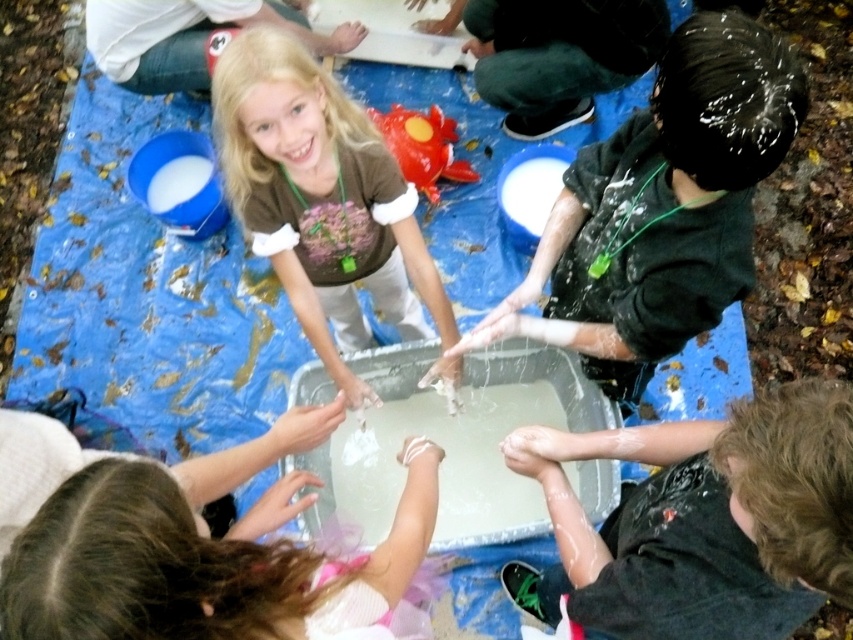
Question: Does dark green hoodie at upper right appear over matte brown shirt at center?

Choices:
 (A) no
 (B) yes

Answer: (A)

Question: Is shiny black shirt at lower right closer to the viewer compared to matte brown shirt at center?

Choices:
 (A) yes
 (B) no

Answer: (A)

Question: Considering the real-world distances, which object is farthest from the shiny black shirt at lower right?

Choices:
 (A) smooth pink dress at lower left
 (B) white matte hand at center

Answer: (B)

Question: Which point appears closest to the camera in this image?

Choices:
 (A) (759, 394)
 (B) (302, 268)
 (C) (598, 342)
 (D) (517, 468)

Answer: (D)

Question: Which point is closer to the camera?

Choices:
 (A) (544, 259)
 (B) (341, 385)
 (C) (554, 500)

Answer: (C)

Question: Is shiny black shirt at lower right positioned in front of white matte hand at lower center?

Choices:
 (A) no
 (B) yes

Answer: (B)